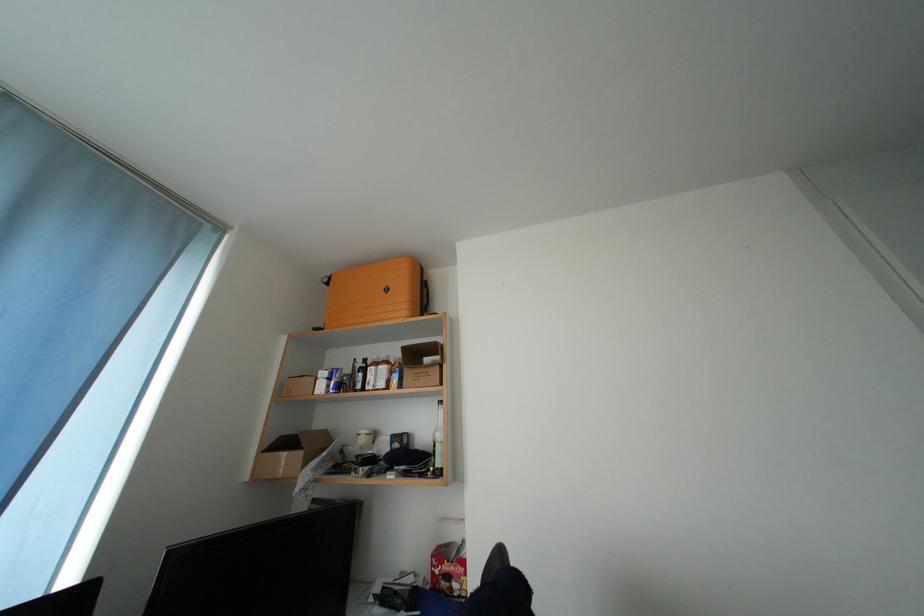
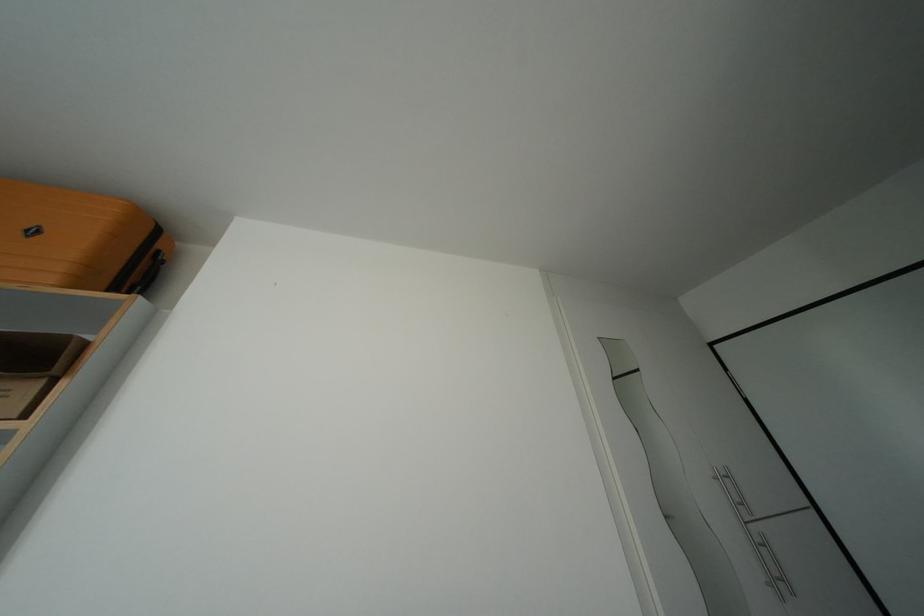
Question: The first image is from the beginning of the video and the second image is from the end. How did the camera likely rotate when shooting the video?

Choices:
 (A) Left
 (B) Right
 (C) Up
 (D) Down

Answer: (B)